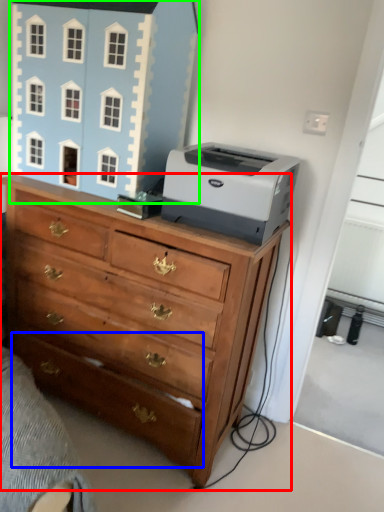
Question: Considering the real-world distances, which object is farthest from chest of drawers (highlighted by a red box)? drawer (highlighted by a blue box) or toy (highlighted by a green box)?

Choices:
 (A) drawer
 (B) toy

Answer: (B)